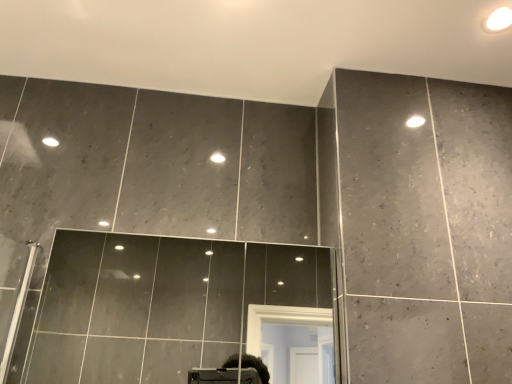
Find the location of a particular element. smooth glass mirror at center is located at coordinates (159, 303).

What do you see at coordinates (159, 303) in the screenshot? The image size is (512, 384). I see `smooth glass mirror at center` at bounding box center [159, 303].

This screenshot has width=512, height=384. I want to click on smooth glass mirror at center, so click(x=159, y=303).